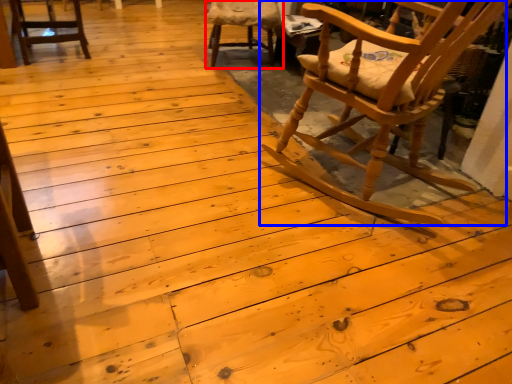
Question: Which object is closer to the camera taking this photo, chair (highlighted by a red box) or chair (highlighted by a blue box)?

Choices:
 (A) chair
 (B) chair

Answer: (B)